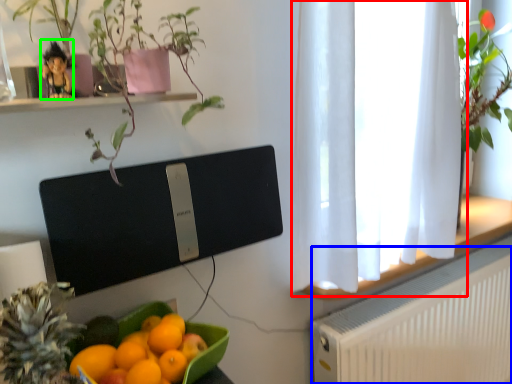
Question: Considering the real-world distances, which object is closest to window frame (highlighted by a red box)? radiator (highlighted by a blue box) or toy (highlighted by a green box).

Choices:
 (A) radiator
 (B) toy

Answer: (A)